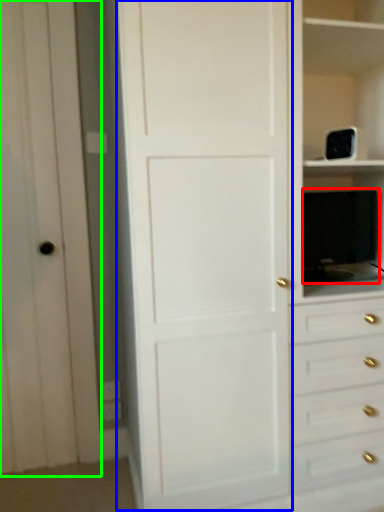
Question: Which is nearer to the appliance (highlighted by a red box)? door (highlighted by a blue box) or glass door (highlighted by a green box).

Choices:
 (A) door
 (B) glass door

Answer: (A)